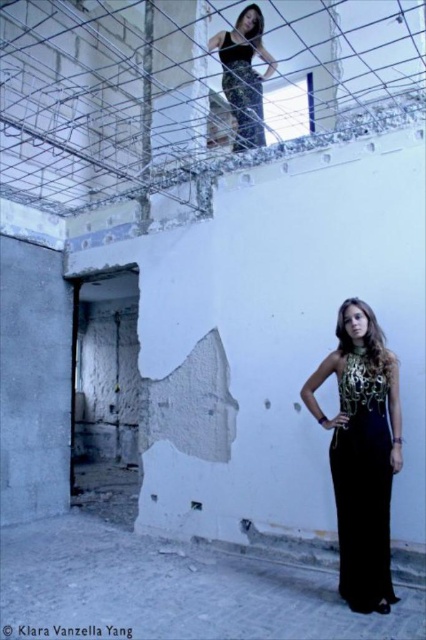
Question: Is black satin dress at lower center bigger than shiny black dress at upper center?

Choices:
 (A) yes
 (B) no

Answer: (B)

Question: Based on their relative distances, which object is farther from the shiny black dress at upper center?

Choices:
 (A) metallic wire mesh at upper center
 (B) black satin dress at lower center

Answer: (B)

Question: Where is metallic wire mesh at upper center located in relation to shiny black dress at upper center in the image?

Choices:
 (A) left
 (B) right

Answer: (A)

Question: Estimate the real-world distances between objects in this image. Which object is closer to the metallic wire mesh at upper center?

Choices:
 (A) shiny black dress at upper center
 (B) black satin dress at lower center

Answer: (A)

Question: Which point is farther to the camera?

Choices:
 (A) (238, 128)
 (B) (348, 554)

Answer: (A)

Question: Does metallic wire mesh at upper center appear on the right side of black satin dress at lower center?

Choices:
 (A) yes
 (B) no

Answer: (B)